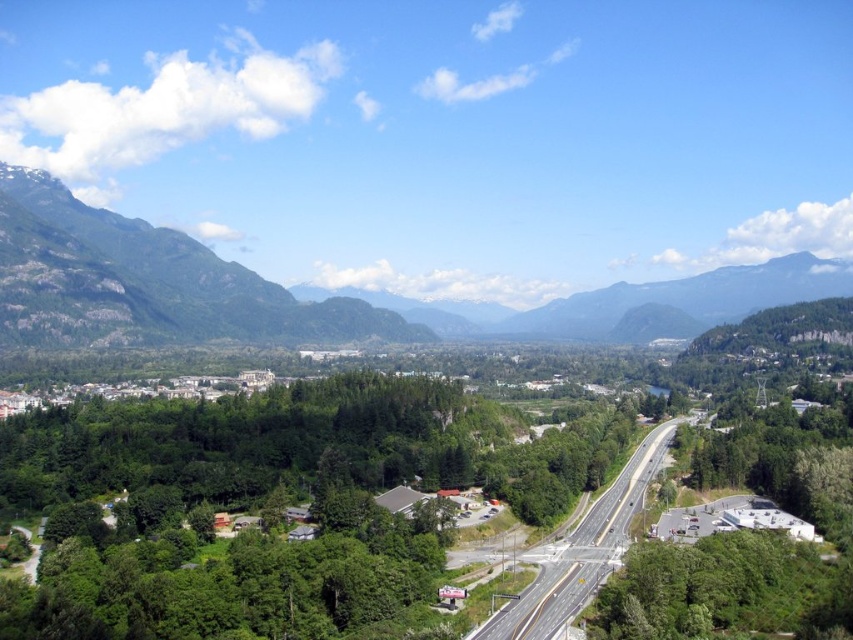
Question: Among these objects, which one is farthest from the camera?

Choices:
 (A) green leafy tree at lower right
 (B) green rock mountain at upper left
 (C) asphalt road at center

Answer: (B)

Question: Is green rock mountain at upper left positioned in front of green leafy tree at lower right?

Choices:
 (A) no
 (B) yes

Answer: (A)

Question: Does green rock mountain at upper left appear on the right side of green leafy tree at lower right?

Choices:
 (A) no
 (B) yes

Answer: (A)

Question: Which point is farther from the camera taking this photo?

Choices:
 (A) (26, 268)
 (B) (775, 573)

Answer: (A)

Question: Observing the image, what is the correct spatial positioning of green rock mountain at upper left in reference to asphalt road at center?

Choices:
 (A) below
 (B) above

Answer: (B)

Question: Which of the following is the closest to the observer?

Choices:
 (A) click(x=793, y=577)
 (B) click(x=569, y=598)

Answer: (A)